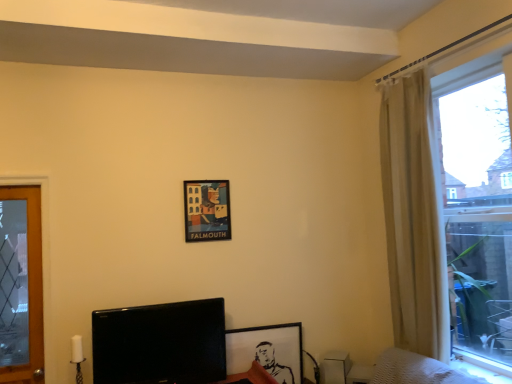
In the scene shown: Measure the distance between point (418, 106) and camera.

A distance of 2.60 meters exists between point (418, 106) and camera.

This screenshot has height=384, width=512. What do you see at coordinates (450, 209) in the screenshot?
I see `translucent glass window at right` at bounding box center [450, 209].

Locate an element on the screen. This screenshot has height=384, width=512. beige fabric curtain at right is located at coordinates (413, 217).

Image resolution: width=512 pixels, height=384 pixels. I want to click on television behind the beige fabric curtain at right, so click(x=160, y=343).

Which object is closer to the camera, black glossy tv at lower left or beige fabric curtain at right?

Positioned in front is beige fabric curtain at right.

Is black glossy tv at lower left spatially inside beige fabric curtain at right, or outside of it?

black glossy tv at lower left is outside beige fabric curtain at right.

Find the location of a particular element. This screenshot has width=512, height=384. curtain that is above the black matte picture frame at lower center, the first picture frame in the right-to-left sequence (from the image's perspective) is located at coordinates click(x=413, y=217).

From the image's perspective, is beige fabric curtain at right on top of black matte picture frame at lower center, the first picture frame in the right-to-left sequence?

Indeed, from the image's perspective, beige fabric curtain at right is shown above black matte picture frame at lower center, the first picture frame in the right-to-left sequence.

Based on the photo, who is shorter, beige fabric curtain at right or black matte picture frame at lower center, the first picture frame from the bottom?

Standing shorter between the two is black matte picture frame at lower center, the first picture frame from the bottom.

Which is more to the right, beige fabric curtain at right or black matte picture frame at lower center, which is the second picture frame in left-to-right order?

beige fabric curtain at right is more to the right.

How different are the orientations of matte paper poster at center, the first picture frame in the left-to-right sequence, and beige fabric curtain at right in degrees?

matte paper poster at center, the first picture frame in the left-to-right sequence, and beige fabric curtain at right are facing 87.9 degrees away from each other.

From the beige fabric curtain at right, count the 2nd picture frame to the left and point to it. Please provide its 2D coordinates.

[(207, 210)]

Is matte paper poster at center, the first picture frame in the left-to-right sequence, far from beige fabric curtain at right?

That's right, there is a large distance between matte paper poster at center, the first picture frame in the left-to-right sequence, and beige fabric curtain at right.

Looking at their sizes, would you say matte paper poster at center, the 2th picture frame from the right, is wider or thinner than beige fabric curtain at right?

Clearly, matte paper poster at center, the 2th picture frame from the right, has less width compared to beige fabric curtain at right.

Do you think black matte picture frame at lower center, the first picture frame from the bottom, is within matte paper poster at center, the 2th picture frame from the right, or outside of it?

black matte picture frame at lower center, the first picture frame from the bottom, is located beyond the bounds of matte paper poster at center, the 2th picture frame from the right.

Is the depth of black matte picture frame at lower center, the first picture frame from the bottom, less than that of matte paper poster at center, which is the second picture frame from bottom to top?

Yes.

Which of these two, black matte picture frame at lower center, the first picture frame from the bottom, or matte paper poster at center, which is the second picture frame from bottom to top, is bigger?

black matte picture frame at lower center, the first picture frame from the bottom, is bigger.

Which is nearer, [193,237] or [198,383]?

The point [198,383] is in front.

Find the location of a particular element. This screenshot has width=512, height=384. picture frame above the black glossy tv at lower left (from a real-world perspective) is located at coordinates (207, 210).

From the picture: Do you think matte paper poster at center, the first picture frame viewed from the top, is within black glossy tv at lower left, or outside of it?

matte paper poster at center, the first picture frame viewed from the top, cannot be found inside black glossy tv at lower left.

Based on their positions, is matte paper poster at center, the first picture frame in the left-to-right sequence, located to the left or right of black glossy tv at lower left?

Clearly, matte paper poster at center, the first picture frame in the left-to-right sequence, is on the right of black glossy tv at lower left in the image.

Based on the photo, is black glossy tv at lower left completely or partially outside of matte paper poster at center, the first picture frame viewed from the top?

Absolutely, black glossy tv at lower left is external to matte paper poster at center, the first picture frame viewed from the top.

Is point (213, 343) positioned in front of point (226, 238)?

That is True.

From the picture: Is black glossy tv at lower left not close to matte paper poster at center, which is the second picture frame from bottom to top?

black glossy tv at lower left is near matte paper poster at center, which is the second picture frame from bottom to top, not far away.

How far apart are black glossy tv at lower left and matte paper poster at center, the 2th picture frame from the right?

They are 27.54 inches apart.

Which of these two, beige fabric curtain at right or matte paper poster at center, the 2th picture frame from the right, stands shorter?

Standing shorter between the two is matte paper poster at center, the 2th picture frame from the right.

Which object is positioned more to the right, beige fabric curtain at right or matte paper poster at center, which is the second picture frame from bottom to top?

From the viewer's perspective, beige fabric curtain at right appears more on the right side.

From the image's perspective, is beige fabric curtain at right over matte paper poster at center, which is the second picture frame from bottom to top?

Yes, from the image's perspective, beige fabric curtain at right is over matte paper poster at center, which is the second picture frame from bottom to top.

The height and width of the screenshot is (384, 512). I want to click on picture frame that is the 2nd one when counting leftward from the beige fabric curtain at right, so pos(207,210).

This screenshot has width=512, height=384. Identify the location of television behind the beige fabric curtain at right. (160, 343).

The height and width of the screenshot is (384, 512). Identify the location of curtain in front of the black matte picture frame at lower center, the first picture frame from the bottom. (413, 217).

Based on their spatial positions, is beige fabric curtain at right or black glossy tv at lower left closer to black matte picture frame at lower center, which is the second picture frame in left-to-right order?

Among the two, black glossy tv at lower left is located nearer to black matte picture frame at lower center, which is the second picture frame in left-to-right order.

When comparing their distances from matte paper poster at center, the first picture frame viewed from the top, does translucent glass window at right or black matte picture frame at lower center, the first picture frame in the right-to-left sequence, seem further?

The object further to matte paper poster at center, the first picture frame viewed from the top, is translucent glass window at right.

Which object lies further to the anchor point beige fabric curtain at right, translucent glass window at right or black matte picture frame at lower center, which is the second picture frame in left-to-right order?

Based on the image, black matte picture frame at lower center, which is the second picture frame in left-to-right order, appears to be further to beige fabric curtain at right.

When comparing their distances from black glossy tv at lower left, does matte paper poster at center, which is the second picture frame from bottom to top, or beige fabric curtain at right seem closer?

matte paper poster at center, which is the second picture frame from bottom to top, is closer to black glossy tv at lower left.

Based on their spatial positions, is matte paper poster at center, the first picture frame in the left-to-right sequence, or black matte picture frame at lower center, the first picture frame in the right-to-left sequence, closer to beige fabric curtain at right?

The object closer to beige fabric curtain at right is black matte picture frame at lower center, the first picture frame in the right-to-left sequence.

When comparing their distances from translucent glass window at right, does matte paper poster at center, the 2th picture frame from the right, or black glossy tv at lower left seem closer?

matte paper poster at center, the 2th picture frame from the right, lies closer to translucent glass window at right than the other object.

Considering their positions, is black matte picture frame at lower center, which appears as the second picture frame when viewed from the top, positioned closer to translucent glass window at right than black glossy tv at lower left?

black matte picture frame at lower center, which appears as the second picture frame when viewed from the top, lies closer to translucent glass window at right than the other object.

Which object lies further to the anchor point beige fabric curtain at right, black glossy tv at lower left or translucent glass window at right?

black glossy tv at lower left is positioned further to the anchor beige fabric curtain at right.

The width and height of the screenshot is (512, 384). Find the location of `curtain between black glossy tv at lower left and translucent glass window at right from left to right`. curtain between black glossy tv at lower left and translucent glass window at right from left to right is located at coordinates (413, 217).

Where is `picture frame situated between matte paper poster at center, the 2th picture frame from the right, and beige fabric curtain at right from left to right`? Image resolution: width=512 pixels, height=384 pixels. picture frame situated between matte paper poster at center, the 2th picture frame from the right, and beige fabric curtain at right from left to right is located at coordinates (267, 351).

This screenshot has height=384, width=512. I want to click on curtain situated between black matte picture frame at lower center, which is the second picture frame in left-to-right order, and translucent glass window at right from left to right, so click(x=413, y=217).

Where is `television that lies between matte paper poster at center, the first picture frame viewed from the top, and black matte picture frame at lower center, the first picture frame from the bottom, from top to bottom`? Image resolution: width=512 pixels, height=384 pixels. television that lies between matte paper poster at center, the first picture frame viewed from the top, and black matte picture frame at lower center, the first picture frame from the bottom, from top to bottom is located at coordinates (160, 343).